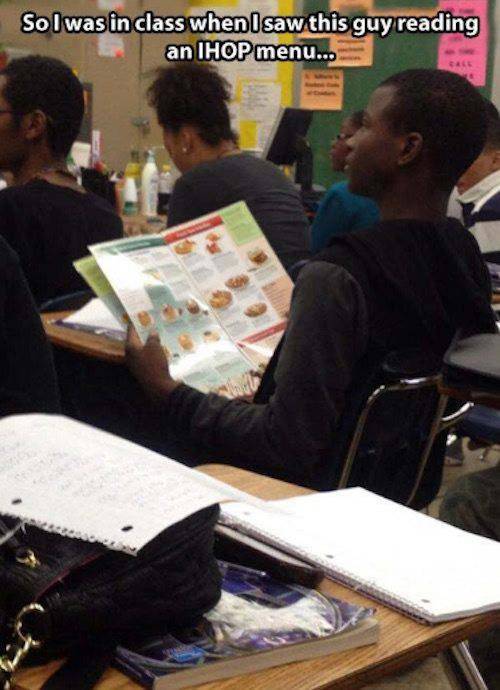
Where is `picture of kids in a classroom`? The height and width of the screenshot is (690, 500). picture of kids in a classroom is located at coordinates (305, 148).